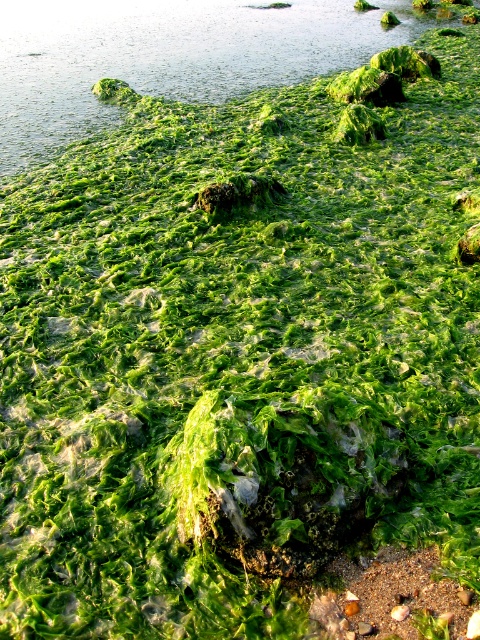
Can you confirm if green algae at upper center is positioned below smooth brown sand at bottom right?

No.

Does green algae at upper center have a larger size compared to smooth brown sand at bottom right?

Indeed, green algae at upper center has a larger size compared to smooth brown sand at bottom right.

The image size is (480, 640). Find the location of `green algae at upper center`. green algae at upper center is located at coordinates (168, 56).